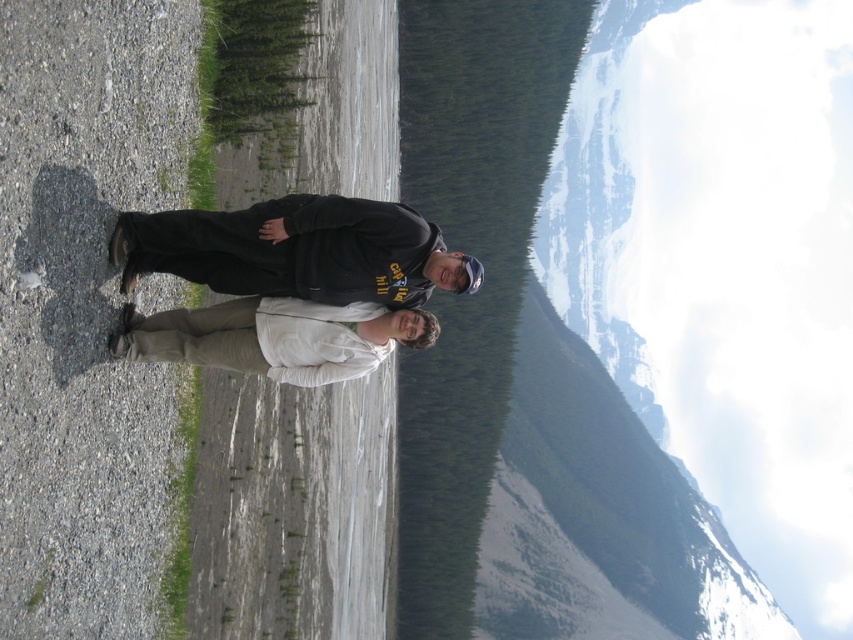
You are standing at the lake shore and want to reach a specific point marked at coordinates point (126, 268). If your walking speed is 1.5 meters per second, how many seconds will it take you to reach that point?

The point (126, 268) is 45.92 meters away from the viewer. At a walking speed of 1.5 meters per second, it would take approximately 30.6 seconds to reach the point.

You are a photographer trying to capture a clear shot of both the black matte hoodie at center and the white matte jacket at center. Based on their positions, which one is closer to the camera?

The white matte jacket at center is closer to the camera because the black matte hoodie at center is positioned above it, indicating it is farther back.